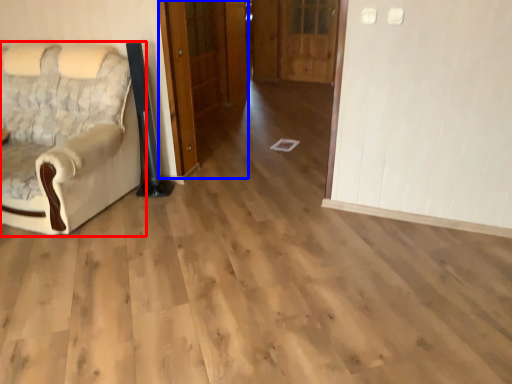
Question: Among these objects, which one is farthest to the camera, chair (highlighted by a red box) or door (highlighted by a blue box)?

Choices:
 (A) chair
 (B) door

Answer: (B)